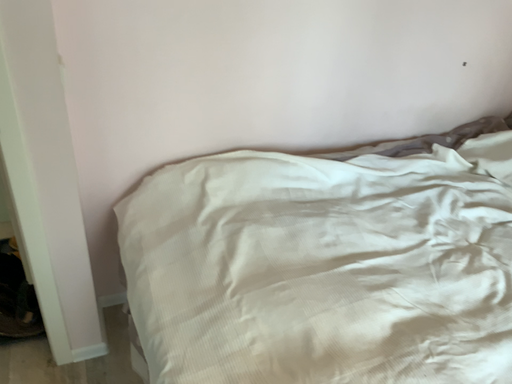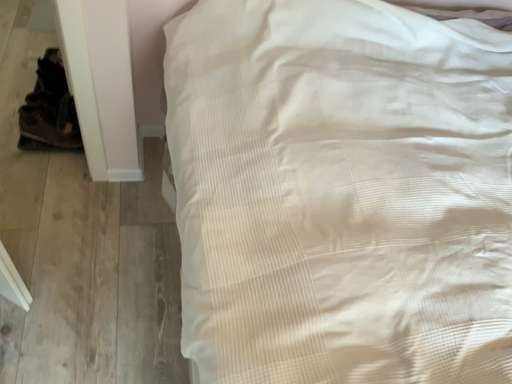
Question: How did the camera likely rotate when shooting the video?

Choices:
 (A) rotated right
 (B) rotated left

Answer: (B)